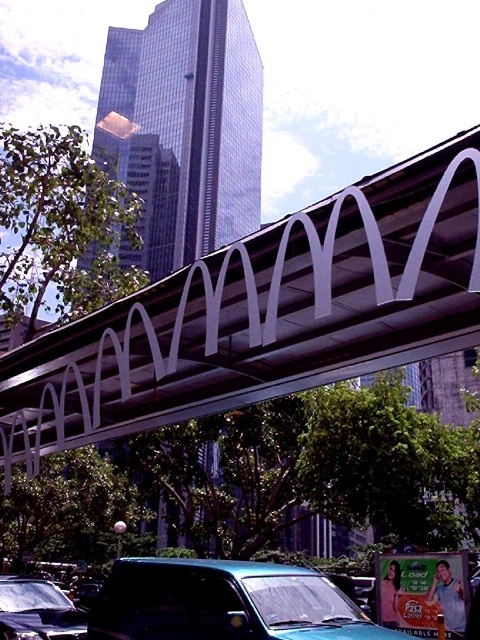
Can you confirm if metallic silver pedestrian bridge at center is smaller than teal matte van at lower center?

Incorrect, metallic silver pedestrian bridge at center is not smaller in size than teal matte van at lower center.

Between metallic silver pedestrian bridge at center and teal matte van at lower center, which one is positioned higher?

Positioned higher is metallic silver pedestrian bridge at center.

Where is `metallic silver pedestrian bridge at center`? This screenshot has width=480, height=640. metallic silver pedestrian bridge at center is located at coordinates (264, 314).

Is teal matte van at lower center positioned behind shiny black car at lower left?

No.

From the picture: Is teal matte van at lower center thinner than shiny black car at lower left?

Yes.

Between point (206, 572) and point (47, 593), which one is positioned behind?

Point (47, 593)

This screenshot has width=480, height=640. I want to click on teal matte van at lower center, so click(225, 602).

Is metallic silver pedestrian bridge at center taller than shiny black car at lower left?

Incorrect, metallic silver pedestrian bridge at center's height is not larger of shiny black car at lower left's.

Who is shorter, metallic silver pedestrian bridge at center or shiny black car at lower left?

metallic silver pedestrian bridge at center is shorter.

This screenshot has height=640, width=480. What do you see at coordinates (264, 314) in the screenshot?
I see `metallic silver pedestrian bridge at center` at bounding box center [264, 314].

The width and height of the screenshot is (480, 640). In order to click on metallic silver pedestrian bridge at center in this screenshot , I will do `click(264, 314)`.